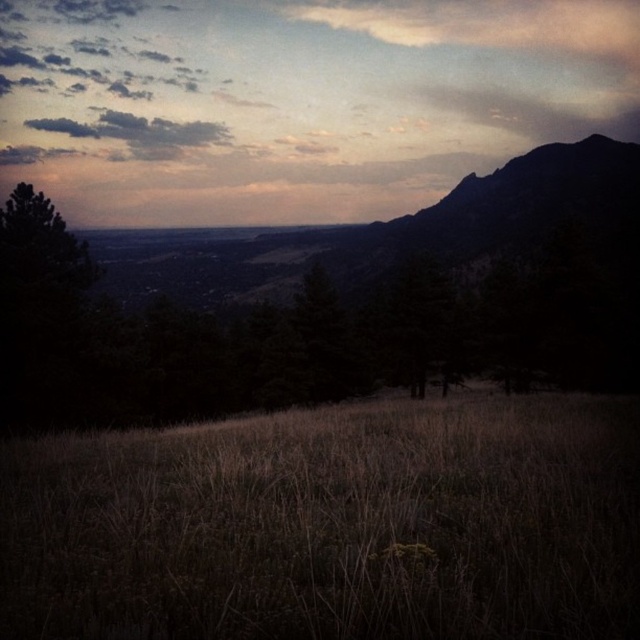
Can you confirm if matte sky at upper center is positioned to the left of dark gray cloud at upper left?

In fact, matte sky at upper center is to the right of dark gray cloud at upper left.

The image size is (640, 640). What do you see at coordinates (298, 100) in the screenshot? I see `matte sky at upper center` at bounding box center [298, 100].

Locate an element on the screen. This screenshot has height=640, width=640. matte sky at upper center is located at coordinates (298, 100).

Does dry grass at center have a greater width compared to dark gray cloud at upper left?

Incorrect, dry grass at center's width does not surpass dark gray cloud at upper left's.

Which is more to the right, dry grass at center or dark gray cloud at upper left?

From the viewer's perspective, dry grass at center appears more on the right side.

Where is `dry grass at center`? This screenshot has width=640, height=640. dry grass at center is located at coordinates (332, 525).

Between dry grass at center and matte sky at upper center, which one is positioned higher?

matte sky at upper center is higher up.

Is point (604, 474) in front of point (140, 195)?

Yes, it is.

The image size is (640, 640). Find the location of `dry grass at center`. dry grass at center is located at coordinates (332, 525).